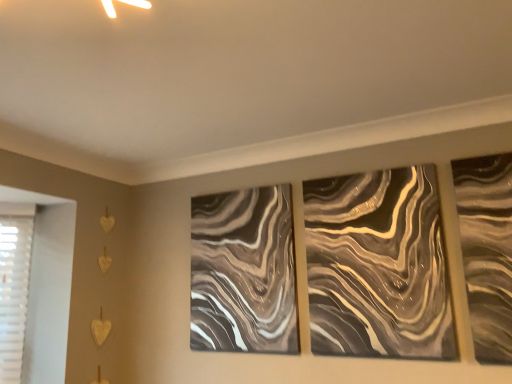
Describe the element at coordinates (243, 272) in the screenshot. This screenshot has height=384, width=512. I see `metallic swirl art at center, positioned as the second design in right-to-left order` at that location.

What is the approximate width of metallic swirl art at center, positioned as the second design in right-to-left order?

It is 2.08 inches.

Where is `metallic swirl art at center, the first design from the left`? This screenshot has width=512, height=384. metallic swirl art at center, the first design from the left is located at coordinates (243, 272).

Locate an element on the screen. metallic swirl art at center-right, the 2th design from the left is located at coordinates (378, 266).

Describe the element at coordinates (378, 266) in the screenshot. I see `metallic swirl art at center-right, acting as the first design starting from the right` at that location.

At what (x,y) coordinates should I click in order to perform the action: click on metallic swirl art at center, positioned as the second design in right-to-left order. Please return your answer as a coordinate pair (x, y). Looking at the image, I should click on (243, 272).

Considering the relative positions of metallic swirl art at center-right, the 2th design from the left, and metallic swirl art at center, positioned as the second design in right-to-left order, in the image provided, is metallic swirl art at center-right, the 2th design from the left, to the left of metallic swirl art at center, positioned as the second design in right-to-left order, from the viewer's perspective?

Incorrect, metallic swirl art at center-right, the 2th design from the left, is not on the left side of metallic swirl art at center, positioned as the second design in right-to-left order.

Which is in front, metallic swirl art at center-right, the 2th design from the left, or metallic swirl art at center, the first design from the left?

metallic swirl art at center-right, the 2th design from the left, is closer to the camera.

Considering the points (447, 303) and (192, 258), which point is behind, point (447, 303) or point (192, 258)?

The point (192, 258) is farther from the camera.

From the image's perspective, which one is positioned lower, metallic swirl art at center-right, acting as the first design starting from the right, or metallic swirl art at center, the first design from the left?

From the image's view, metallic swirl art at center, the first design from the left, is below.

From a real-world perspective, which is physically below, metallic swirl art at center-right, the 2th design from the left, or metallic swirl art at center, positioned as the second design in right-to-left order?

From a 3D spatial view, metallic swirl art at center-right, the 2th design from the left, is below.

Between metallic swirl art at center-right, acting as the first design starting from the right, and metallic swirl art at center, the first design from the left, which one has larger width?

Wider between the two is metallic swirl art at center, the first design from the left.

Considering the sizes of objects metallic swirl art at center-right, the 2th design from the left, and metallic swirl art at center, the first design from the left, in the image provided, who is shorter, metallic swirl art at center-right, the 2th design from the left, or metallic swirl art at center, the first design from the left,?

Standing shorter between the two is metallic swirl art at center-right, the 2th design from the left.

Is metallic swirl art at center-right, the 2th design from the left, bigger or smaller than metallic swirl art at center, positioned as the second design in right-to-left order?

metallic swirl art at center-right, the 2th design from the left, is smaller than metallic swirl art at center, positioned as the second design in right-to-left order.

Do you think metallic swirl art at center-right, the 2th design from the left, is within metallic swirl art at center, the first design from the left, or outside of it?

metallic swirl art at center-right, the 2th design from the left, is not inside metallic swirl art at center, the first design from the left, it's outside.

Is metallic swirl art at center-right, the 2th design from the left, touching metallic swirl art at center, positioned as the second design in right-to-left order?

metallic swirl art at center-right, the 2th design from the left, and metallic swirl art at center, positioned as the second design in right-to-left order, are clearly separated.

Is metallic swirl art at center-right, acting as the first design starting from the right, turned away from metallic swirl art at center, the first design from the left?

No, metallic swirl art at center-right, acting as the first design starting from the right, is not facing away from metallic swirl art at center, the first design from the left.

Find the location of a particular element. The height and width of the screenshot is (384, 512). design lying above the metallic swirl art at center, positioned as the second design in right-to-left order (from the image's perspective) is located at coordinates (378, 266).

Which is more to the left, metallic swirl art at center, positioned as the second design in right-to-left order, or metallic swirl art at center-right, the 2th design from the left?

metallic swirl art at center, positioned as the second design in right-to-left order.

Is metallic swirl art at center, the first design from the left, in front of or behind metallic swirl art at center-right, acting as the first design starting from the right, in the image?

metallic swirl art at center, the first design from the left, is behind metallic swirl art at center-right, acting as the first design starting from the right.

Considering the points (226, 309) and (388, 188), which point is behind, point (226, 309) or point (388, 188)?

The point (226, 309) is behind.

From the image's perspective, is metallic swirl art at center, positioned as the second design in right-to-left order, under metallic swirl art at center-right, acting as the first design starting from the right?

Correct, metallic swirl art at center, positioned as the second design in right-to-left order, appears lower than metallic swirl art at center-right, acting as the first design starting from the right, in the image.

From a real-world perspective, is metallic swirl art at center, positioned as the second design in right-to-left order, positioned above or below metallic swirl art at center-right, acting as the first design starting from the right?

metallic swirl art at center, positioned as the second design in right-to-left order, is situated higher than metallic swirl art at center-right, acting as the first design starting from the right, in the real world.

Does metallic swirl art at center, positioned as the second design in right-to-left order, have a lesser width compared to metallic swirl art at center-right, the 2th design from the left?

Incorrect, the width of metallic swirl art at center, positioned as the second design in right-to-left order, is not less than that of metallic swirl art at center-right, the 2th design from the left.

Does metallic swirl art at center, the first design from the left, have a lesser height compared to metallic swirl art at center-right, the 2th design from the left?

In fact, metallic swirl art at center, the first design from the left, may be taller than metallic swirl art at center-right, the 2th design from the left.

Is metallic swirl art at center, the first design from the left, smaller than metallic swirl art at center-right, acting as the first design starting from the right?

Actually, metallic swirl art at center, the first design from the left, might be larger than metallic swirl art at center-right, acting as the first design starting from the right.

Can metallic swirl art at center-right, acting as the first design starting from the right, be found inside metallic swirl art at center, the first design from the left?

No, metallic swirl art at center-right, acting as the first design starting from the right, is not surrounded by metallic swirl art at center, the first design from the left.

Would you consider metallic swirl art at center, positioned as the second design in right-to-left order, to be distant from metallic swirl art at center-right, acting as the first design starting from the right?

No, metallic swirl art at center, positioned as the second design in right-to-left order, is not far from metallic swirl art at center-right, acting as the first design starting from the right.

Could you tell me if metallic swirl art at center, positioned as the second design in right-to-left order, is turned towards metallic swirl art at center-right, acting as the first design starting from the right?

No, metallic swirl art at center, positioned as the second design in right-to-left order, does not turn towards metallic swirl art at center-right, acting as the first design starting from the right.

How many degrees apart are the facing directions of metallic swirl art at center, the first design from the left, and metallic swirl art at center-right, the 2th design from the left?

They differ by 0.0183 degrees in their facing directions.

How distant is metallic swirl art at center, positioned as the second design in right-to-left order, from metallic swirl art at center-right, the 2th design from the left?

metallic swirl art at center, positioned as the second design in right-to-left order, and metallic swirl art at center-right, the 2th design from the left, are 14.79 inches apart.

Find the location of `design that appears on the left of metallic swirl art at center-right, the 2th design from the left`. design that appears on the left of metallic swirl art at center-right, the 2th design from the left is located at coordinates (243, 272).

The width and height of the screenshot is (512, 384). Identify the location of design on the right of metallic swirl art at center, the first design from the left. (378, 266).

This screenshot has height=384, width=512. I want to click on design directly beneath the metallic swirl art at center, the first design from the left (from a real-world perspective), so click(x=378, y=266).